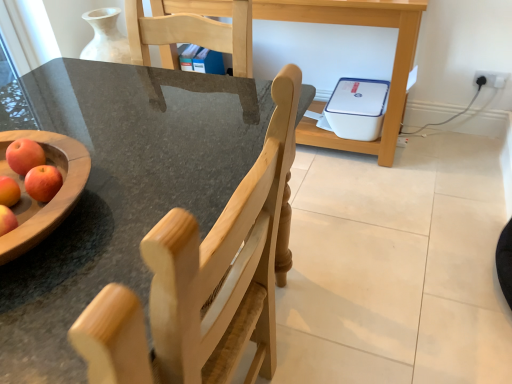
Question: From a real-world perspective, is white plastic printer at center below white plastic electric outlet at upper right?

Choices:
 (A) yes
 (B) no

Answer: (B)

Question: Is white plastic printer at center oriented towards white plastic electric outlet at upper right?

Choices:
 (A) no
 (B) yes

Answer: (A)

Question: Is white plastic printer at center positioned with its back to white plastic electric outlet at upper right?

Choices:
 (A) no
 (B) yes

Answer: (A)

Question: From the image's perspective, would you say white plastic printer at center is shown under white plastic electric outlet at upper right?

Choices:
 (A) yes
 (B) no

Answer: (B)

Question: Is the depth of white plastic printer at center greater than that of white plastic electric outlet at upper right?

Choices:
 (A) yes
 (B) no

Answer: (B)

Question: Are white plastic printer at center and white plastic electric outlet at upper right located far from each other?

Choices:
 (A) no
 (B) yes

Answer: (A)

Question: Can you confirm if natural wood chair at center is positioned to the left of red matte apple at left?

Choices:
 (A) no
 (B) yes

Answer: (A)

Question: Is natural wood chair at center far from red matte apple at left?

Choices:
 (A) yes
 (B) no

Answer: (B)

Question: Is red matte apple at left at the back of natural wood chair at center?

Choices:
 (A) yes
 (B) no

Answer: (B)

Question: Is natural wood chair at center thinner than red matte apple at left?

Choices:
 (A) no
 (B) yes

Answer: (A)

Question: Does natural wood chair at center lie in front of red matte apple at left?

Choices:
 (A) no
 (B) yes

Answer: (B)

Question: Considering the relative sizes of natural wood chair at center and red matte apple at left in the image provided, is natural wood chair at center smaller than red matte apple at left?

Choices:
 (A) no
 (B) yes

Answer: (A)

Question: Is white plastic printer at center thinner than red matte apple at left?

Choices:
 (A) yes
 (B) no

Answer: (B)